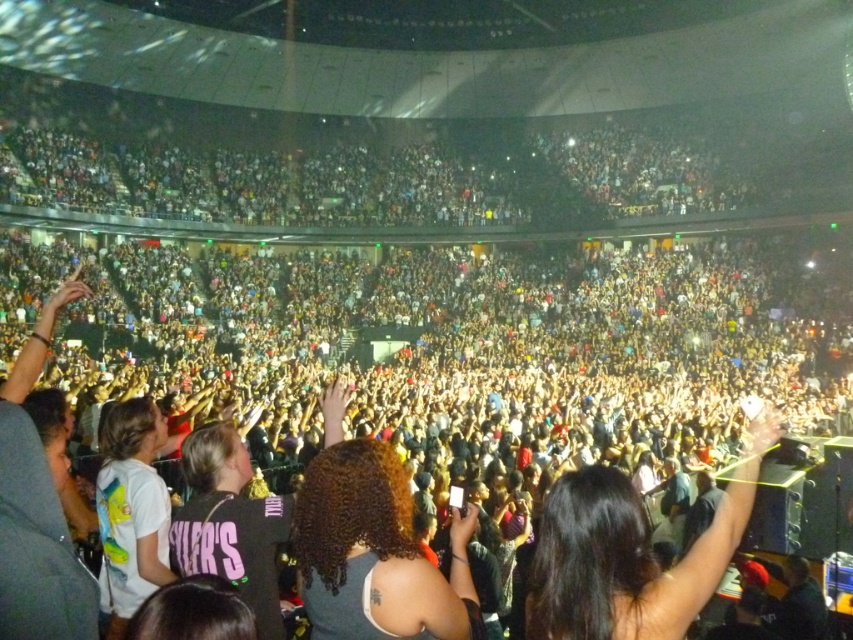
Does black hair at center have a greater width compared to curly hair at center?

Yes.

Does black hair at center have a larger size compared to curly hair at center?

Yes, black hair at center is bigger than curly hair at center.

Which is behind, point (572, 552) or point (456, 570)?

Point (456, 570)

Locate an element on the screen. The image size is (853, 640). black hair at center is located at coordinates [x=630, y=554].

Between curly hair at center and white matte t-shirt at lower left, which one has less height?

white matte t-shirt at lower left

Does curly hair at center have a smaller size compared to white matte t-shirt at lower left?

Incorrect, curly hair at center is not smaller in size than white matte t-shirt at lower left.

This screenshot has height=640, width=853. What do you see at coordinates (374, 552) in the screenshot?
I see `curly hair at center` at bounding box center [374, 552].

This screenshot has width=853, height=640. I want to click on curly hair at center, so click(374, 552).

Can you confirm if black hair at center is positioned to the left of white matte t-shirt at lower left?

→ In fact, black hair at center is to the right of white matte t-shirt at lower left.

This screenshot has width=853, height=640. Describe the element at coordinates (630, 554) in the screenshot. I see `black hair at center` at that location.

I want to click on black hair at center, so click(x=630, y=554).